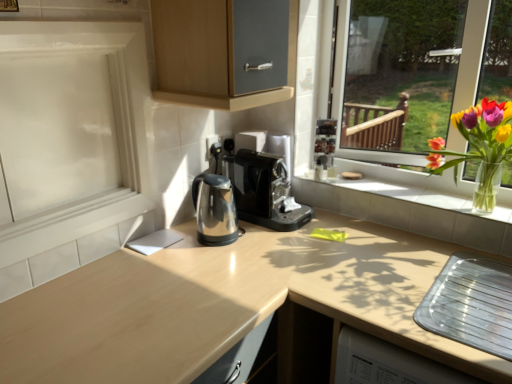
Question: Is white tile window sill at center outside translucent glass vase at right?

Choices:
 (A) yes
 (B) no

Answer: (A)

Question: Could you tell me if white tile window sill at center is facing translucent glass vase at right?

Choices:
 (A) yes
 (B) no

Answer: (B)

Question: Can you confirm if white tile window sill at center is positioned to the right of translucent glass vase at right?

Choices:
 (A) no
 (B) yes

Answer: (A)

Question: Is white tile window sill at center to the left of translucent glass vase at right from the viewer's perspective?

Choices:
 (A) no
 (B) yes

Answer: (B)

Question: From the image's perspective, would you say white tile window sill at center is positioned over translucent glass vase at right?

Choices:
 (A) no
 (B) yes

Answer: (A)

Question: From a real-world perspective, does white tile window sill at center sit lower than translucent glass vase at right?

Choices:
 (A) no
 (B) yes

Answer: (B)

Question: From a real-world perspective, is white tile window sill at center located higher than black plastic coffee machine at center?

Choices:
 (A) no
 (B) yes

Answer: (A)

Question: Is white tile window sill at center oriented towards black plastic coffee machine at center?

Choices:
 (A) no
 (B) yes

Answer: (A)

Question: Considering the relative positions of white tile window sill at center and black plastic coffee machine at center in the image provided, is white tile window sill at center to the right of black plastic coffee machine at center from the viewer's perspective?

Choices:
 (A) yes
 (B) no

Answer: (A)

Question: Is white tile window sill at center positioned before black plastic coffee machine at center?

Choices:
 (A) no
 (B) yes

Answer: (B)

Question: Does white tile window sill at center appear on the left side of black plastic coffee machine at center?

Choices:
 (A) no
 (B) yes

Answer: (A)

Question: Is white tile window sill at center turned away from black plastic coffee machine at center?

Choices:
 (A) yes
 (B) no

Answer: (B)

Question: Does polished metallic kettle at center turn towards black plastic coffee machine at center?

Choices:
 (A) yes
 (B) no

Answer: (B)